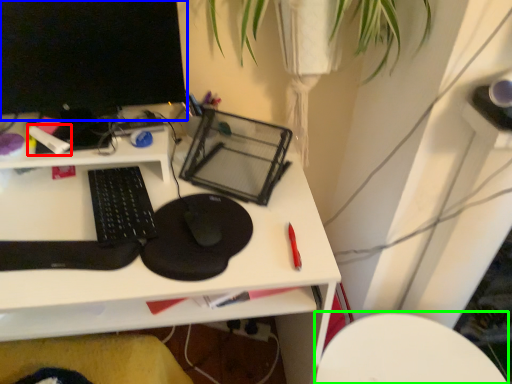
Question: Considering the real-world distances, which object is farthest from stationery (highlighted by a red box)? computer monitor (highlighted by a blue box) or computer chair (highlighted by a green box)?

Choices:
 (A) computer monitor
 (B) computer chair

Answer: (B)